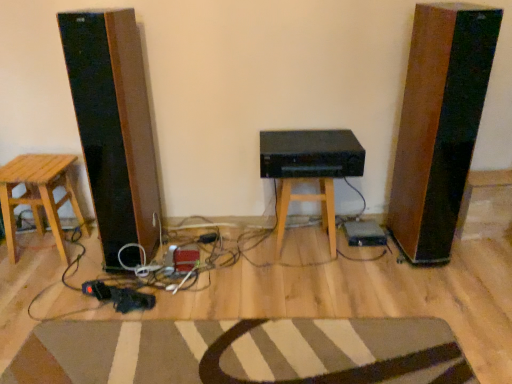
Question: Is wooden stool at center, which is the first stool in right-to-left order, a part of wooden stool at left, arranged as the 1th stool when viewed from the left?

Choices:
 (A) yes
 (B) no

Answer: (B)

Question: Considering the relative sizes of wooden stool at left, arranged as the 1th stool when viewed from the left, and wooden stool at center, which is the first stool in right-to-left order, in the image provided, is wooden stool at left, arranged as the 1th stool when viewed from the left, taller than wooden stool at center, which is the first stool in right-to-left order,?

Choices:
 (A) no
 (B) yes

Answer: (B)

Question: Is wooden stool at left, acting as the second stool starting from the right, turned away from wooden stool at center, which is the first stool in right-to-left order?

Choices:
 (A) yes
 (B) no

Answer: (B)

Question: From the image's perspective, is wooden stool at left, acting as the second stool starting from the right, beneath wooden stool at center, which is the first stool in right-to-left order?

Choices:
 (A) no
 (B) yes

Answer: (B)

Question: Can you confirm if wooden stool at left, arranged as the 1th stool when viewed from the left, is positioned to the right of wooden stool at center, the second stool when ordered from left to right?

Choices:
 (A) no
 (B) yes

Answer: (A)

Question: Does wooden stool at left, acting as the second stool starting from the right, come in front of wooden stool at center, which is the first stool in right-to-left order?

Choices:
 (A) no
 (B) yes

Answer: (B)

Question: Is the surface of black matte speaker at center in direct contact with striped wool doormat at lower center?

Choices:
 (A) no
 (B) yes

Answer: (A)

Question: Does black matte speaker at center come in front of striped wool doormat at lower center?

Choices:
 (A) yes
 (B) no

Answer: (B)

Question: Is black matte speaker at center to the right of striped wool doormat at lower center from the viewer's perspective?

Choices:
 (A) yes
 (B) no

Answer: (A)

Question: From a real-world perspective, is black matte speaker at center located higher than striped wool doormat at lower center?

Choices:
 (A) no
 (B) yes

Answer: (B)

Question: From the image's perspective, is black matte speaker at center under striped wool doormat at lower center?

Choices:
 (A) yes
 (B) no

Answer: (B)

Question: Would you say black matte speaker at center contains striped wool doormat at lower center?

Choices:
 (A) yes
 (B) no

Answer: (B)

Question: From a real-world perspective, is wooden stool at center, the second stool when ordered from left to right, located higher than striped wool doormat at lower center?

Choices:
 (A) no
 (B) yes

Answer: (B)